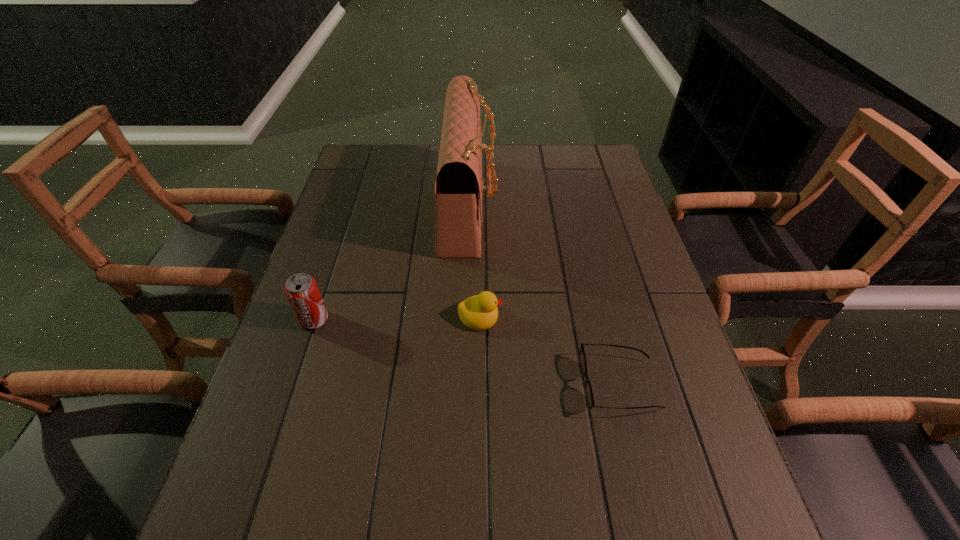
At what (x,y) coordinates should I click in order to perform the action: click on unoccupied area between the farthest object and the soda can. Please return your answer as a coordinate pair (x, y). Looking at the image, I should click on (392, 262).

This screenshot has height=540, width=960. In order to click on free space between the nearest object and the second shortest object in this screenshot , I will do `click(549, 351)`.

Where is `empty space between the second shortest object and the soda can`? empty space between the second shortest object and the soda can is located at coordinates (396, 318).

Where is `empty space between the leftmost object and the spectacles`? The image size is (960, 540). empty space between the leftmost object and the spectacles is located at coordinates (467, 353).

At what (x,y) coordinates should I click in order to perform the action: click on empty space that is in between the third tallest object and the soda can. Please return your answer as a coordinate pair (x, y). Looking at the image, I should click on (396, 318).

You are a GUI agent. You are given a task and a screenshot of the screen. Output one action in this format:
    pyautogui.click(x=<x>, y=<y>)
    Task: Click on the vacant point located between the soda can and the farthest object
    This screenshot has width=960, height=540.
    Given the screenshot: What is the action you would take?
    pyautogui.click(x=392, y=262)

In order to click on vacant space that's between the spectacles and the farthest object in this screenshot , I will do `click(543, 295)`.

The height and width of the screenshot is (540, 960). I want to click on free space between the leftmost object and the shortest object, so click(x=467, y=353).

Where is `vacant area that lies between the spectacles and the leftmost object`? This screenshot has height=540, width=960. vacant area that lies between the spectacles and the leftmost object is located at coordinates (467, 353).

You are a GUI agent. You are given a task and a screenshot of the screen. Output one action in this format:
    pyautogui.click(x=<x>, y=<y>)
    Task: Click on the unoccupied position between the second tallest object and the duckling
    Image resolution: width=960 pixels, height=540 pixels.
    Given the screenshot: What is the action you would take?
    pyautogui.click(x=396, y=318)